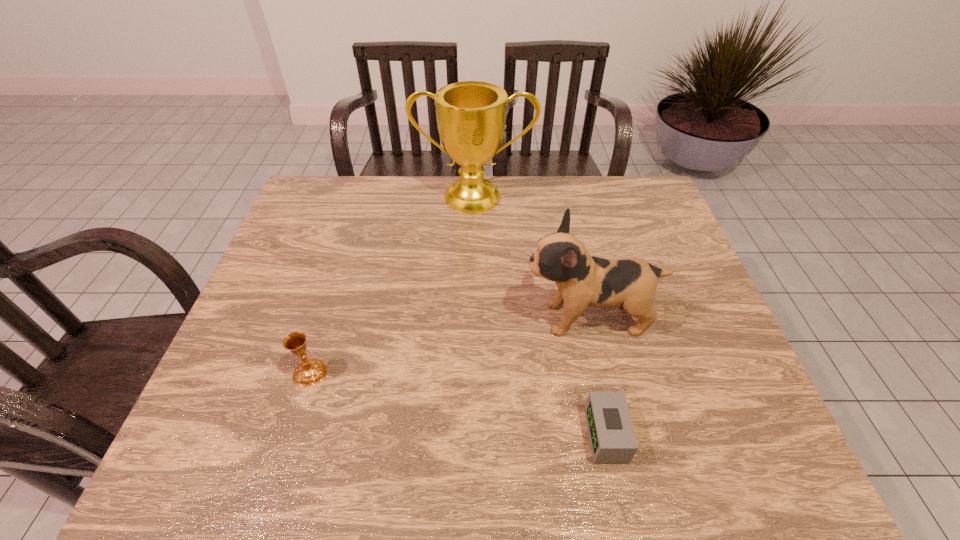
Identify the location of free space at the near edge. (555, 462).

Locate an element on the screen. vacant area at the left edge of the desktop is located at coordinates (273, 394).

Where is `vacant area at the near left corner of the desktop`? vacant area at the near left corner of the desktop is located at coordinates (209, 460).

This screenshot has height=540, width=960. I want to click on vacant space at the far right corner of the desktop, so click(635, 205).

Image resolution: width=960 pixels, height=540 pixels. I want to click on blank region between the leftmost object and the nearest object, so click(458, 404).

What are the coordinates of `unoccupied area between the nearest object and the second tallest object` in the screenshot? It's located at (597, 377).

This screenshot has height=540, width=960. I want to click on vacant area that lies between the leftmost object and the third nearest object, so click(x=449, y=346).

Where is `vacant region between the alarm clock and the second nearest object`? vacant region between the alarm clock and the second nearest object is located at coordinates (458, 404).

I want to click on vacant area between the second nearest object and the farthest object, so click(x=393, y=285).

At what (x,y) coordinates should I click in order to perform the action: click on free spot between the alarm clock and the tallest object. Please return your answer as a coordinate pair (x, y). The height and width of the screenshot is (540, 960). Looking at the image, I should click on (540, 316).